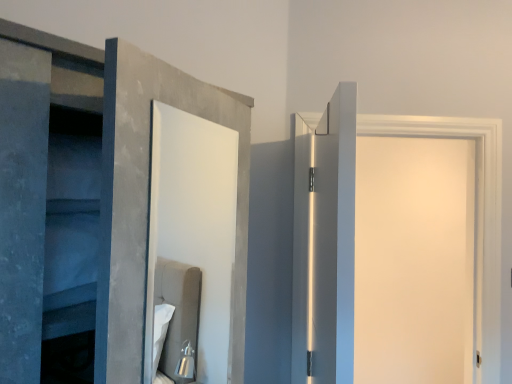
What is the approximate height of white glossy door at upper right, positioned as the first door in left-to-right order?

white glossy door at upper right, positioned as the first door in left-to-right order, is 1.10 meters tall.

Find the location of a particular element. white glossy door at upper right, positioned as the first door in left-to-right order is located at coordinates click(x=325, y=243).

How much space does white glossy door at upper right, placed as the first door when sorted from front to back, occupy horizontally?

white glossy door at upper right, placed as the first door when sorted from front to back, is 10.88 centimeters in width.

This screenshot has width=512, height=384. What do you see at coordinates (325, 243) in the screenshot?
I see `white glossy door at upper right, which ranks as the 2th door in right-to-left order` at bounding box center [325, 243].

You are a GUI agent. You are given a task and a screenshot of the screen. Output one action in this format:
    pyautogui.click(x=<x>, y=<y>)
    Task: Click on the white matte door at right, arranged as the 1th door when viewed from the right
    
    Given the screenshot: What is the action you would take?
    pyautogui.click(x=414, y=260)

Image resolution: width=512 pixels, height=384 pixels. What do you see at coordinates (414, 260) in the screenshot? I see `white matte door at right, arranged as the 1th door when viewed from the right` at bounding box center [414, 260].

At what (x,y) coordinates should I click in order to perform the action: click on white glossy door at upper right, which is counted as the 2th door, starting from the back. Please return your answer as a coordinate pair (x, y). The image size is (512, 384). Looking at the image, I should click on (325, 243).

Is white matte door at right, which ranks as the first door in back-to-front order, at the left side of white glossy door at upper right, placed as the first door when sorted from front to back?

No.

Which object is closer to the camera, white matte door at right, which is the second door from front to back, or white glossy door at upper right, which ranks as the 2th door in right-to-left order?

white glossy door at upper right, which ranks as the 2th door in right-to-left order, is closer to the camera.

Is point (364, 195) positioned in front of point (292, 322)?

That is False.

From the image's perspective, is white matte door at right, which ranks as the first door in back-to-front order, beneath white glossy door at upper right, which is counted as the 2th door, starting from the back?

Yes, from the image's perspective, white matte door at right, which ranks as the first door in back-to-front order, is below white glossy door at upper right, which is counted as the 2th door, starting from the back.

From the picture: From a real-world perspective, is white matte door at right, the 2th door from the left, beneath white glossy door at upper right, positioned as the first door in left-to-right order?

No, from a real-world perspective, white matte door at right, the 2th door from the left, is not below white glossy door at upper right, positioned as the first door in left-to-right order.

Between white matte door at right, the 2th door from the left, and white glossy door at upper right, placed as the first door when sorted from front to back, which one has smaller width?

white glossy door at upper right, placed as the first door when sorted from front to back, is thinner.

Is white matte door at right, which ranks as the first door in back-to-front order, taller than white glossy door at upper right, which is counted as the 2th door, starting from the back?

Indeed, white matte door at right, which ranks as the first door in back-to-front order, has a greater height compared to white glossy door at upper right, which is counted as the 2th door, starting from the back.

Considering the relative sizes of white matte door at right, arranged as the 1th door when viewed from the right, and white glossy door at upper right, which ranks as the 2th door in right-to-left order, in the image provided, is white matte door at right, arranged as the 1th door when viewed from the right, smaller than white glossy door at upper right, which ranks as the 2th door in right-to-left order,?

Incorrect, white matte door at right, arranged as the 1th door when viewed from the right, is not smaller in size than white glossy door at upper right, which ranks as the 2th door in right-to-left order.

Could white glossy door at upper right, placed as the first door when sorted from front to back, be considered to be inside white matte door at right, which is the second door from front to back?

No.

Does white matte door at right, the 2th door from the left, touch white glossy door at upper right, positioned as the first door in left-to-right order?

white matte door at right, the 2th door from the left, and white glossy door at upper right, positioned as the first door in left-to-right order, are not in contact.

Is white matte door at right, which is the second door from front to back, facing towards white glossy door at upper right, which is counted as the 2th door, starting from the back?

No, white matte door at right, which is the second door from front to back, is not oriented towards white glossy door at upper right, which is counted as the 2th door, starting from the back.

In the scene shown: How many degrees apart are the facing directions of white matte door at right, arranged as the 1th door when viewed from the right, and white glossy door at upper right, positioned as the first door in left-to-right order?

83.9 degrees.

How far apart are white matte door at right, which ranks as the first door in back-to-front order, and white glossy door at upper right, placed as the first door when sorted from front to back?

They are 5.18 feet apart.

The height and width of the screenshot is (384, 512). In order to click on door behind the white glossy door at upper right, which ranks as the 2th door in right-to-left order in this screenshot , I will do `click(414, 260)`.

Can you confirm if white glossy door at upper right, which is counted as the 2th door, starting from the back, is positioned to the right of white matte door at right, which ranks as the first door in back-to-front order?

No.

Is white glossy door at upper right, positioned as the first door in left-to-right order, positioned before white matte door at right, which is the second door from front to back?

Yes, it is in front of white matte door at right, which is the second door from front to back.

Does point (294, 286) come in front of point (377, 261)?

That is True.

From the image's perspective, is white glossy door at upper right, positioned as the first door in left-to-right order, located above or below white matte door at right, which is the second door from front to back?

white glossy door at upper right, positioned as the first door in left-to-right order, is situated higher than white matte door at right, which is the second door from front to back, in the image.

From a real-world perspective, is white glossy door at upper right, which is counted as the 2th door, starting from the back, positioned above or below white matte door at right, arranged as the 1th door when viewed from the right?

In terms of real-world spatial position, white glossy door at upper right, which is counted as the 2th door, starting from the back, is below white matte door at right, arranged as the 1th door when viewed from the right.

Considering the sizes of objects white glossy door at upper right, which is counted as the 2th door, starting from the back, and white matte door at right, which ranks as the first door in back-to-front order, in the image provided, who is wider, white glossy door at upper right, which is counted as the 2th door, starting from the back, or white matte door at right, which ranks as the first door in back-to-front order,?

white matte door at right, which ranks as the first door in back-to-front order, is wider.

Is white glossy door at upper right, which is counted as the 2th door, starting from the back, taller than white matte door at right, arranged as the 1th door when viewed from the right?

No.

Does white glossy door at upper right, which is counted as the 2th door, starting from the back, have a larger size compared to white matte door at right, arranged as the 1th door when viewed from the right?

No, white glossy door at upper right, which is counted as the 2th door, starting from the back, is not bigger than white matte door at right, arranged as the 1th door when viewed from the right.

Is white glossy door at upper right, which is counted as the 2th door, starting from the back, spatially inside white matte door at right, which is the second door from front to back, or outside of it?

white glossy door at upper right, which is counted as the 2th door, starting from the back, is spatially situated outside white matte door at right, which is the second door from front to back.

Are white glossy door at upper right, which is counted as the 2th door, starting from the back, and white matte door at right, which is the second door from front to back, far apart?

Yes, white glossy door at upper right, which is counted as the 2th door, starting from the back, is far from white matte door at right, which is the second door from front to back.

Is white glossy door at upper right, which is counted as the 2th door, starting from the back, facing towards white matte door at right, which ranks as the first door in back-to-front order?

Yes, white glossy door at upper right, which is counted as the 2th door, starting from the back, is aimed at white matte door at right, which ranks as the first door in back-to-front order.

I want to click on door positioned vertically above the white glossy door at upper right, which ranks as the 2th door in right-to-left order (from a real-world perspective), so click(x=414, y=260).

This screenshot has height=384, width=512. Identify the location of door that is on the left side of white matte door at right, which ranks as the first door in back-to-front order. coord(325,243).

In the image, there is a white glossy door at upper right, which ranks as the 2th door in right-to-left order. Where is `door below it (from the image's perspective)`? door below it (from the image's perspective) is located at coordinates (414, 260).